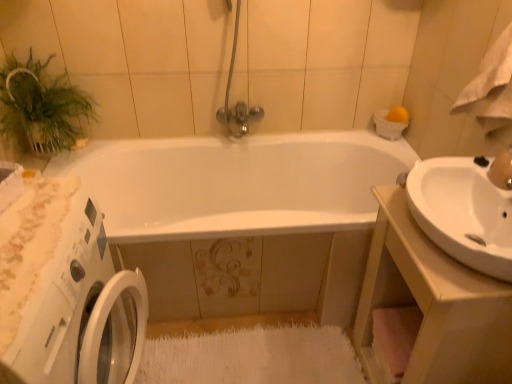
Question: Is white glossy washing machine at left smaller than white glossy sink at right?

Choices:
 (A) yes
 (B) no

Answer: (B)

Question: Is white glossy washing machine at left in contact with white glossy sink at right?

Choices:
 (A) no
 (B) yes

Answer: (A)

Question: Is white glossy washing machine at left oriented towards white glossy sink at right?

Choices:
 (A) yes
 (B) no

Answer: (A)

Question: Is white glossy sink at right located within white glossy washing machine at left?

Choices:
 (A) no
 (B) yes

Answer: (A)

Question: Does white glossy washing machine at left have a larger size compared to white glossy sink at right?

Choices:
 (A) no
 (B) yes

Answer: (B)

Question: Does white glossy washing machine at left appear on the left side of white glossy sink at right?

Choices:
 (A) no
 (B) yes

Answer: (B)

Question: Can we say white glossy sink at right lies outside white glossy washing machine at left?

Choices:
 (A) yes
 (B) no

Answer: (A)

Question: Considering the relative sizes of white glossy sink at right and white glossy washing machine at left in the image provided, is white glossy sink at right shorter than white glossy washing machine at left?

Choices:
 (A) no
 (B) yes

Answer: (B)

Question: Is white glossy sink at right in front of white glossy washing machine at left?

Choices:
 (A) no
 (B) yes

Answer: (A)

Question: From a real-world perspective, is white glossy sink at right physically above white glossy washing machine at left?

Choices:
 (A) yes
 (B) no

Answer: (A)

Question: Does white glossy sink at right have a greater height compared to white glossy washing machine at left?

Choices:
 (A) yes
 (B) no

Answer: (B)

Question: Can you confirm if white glossy sink at right is positioned to the right of white glossy washing machine at left?

Choices:
 (A) yes
 (B) no

Answer: (A)

Question: Does white glossy sink at right have a greater height compared to green leafy plant at upper left?

Choices:
 (A) no
 (B) yes

Answer: (B)